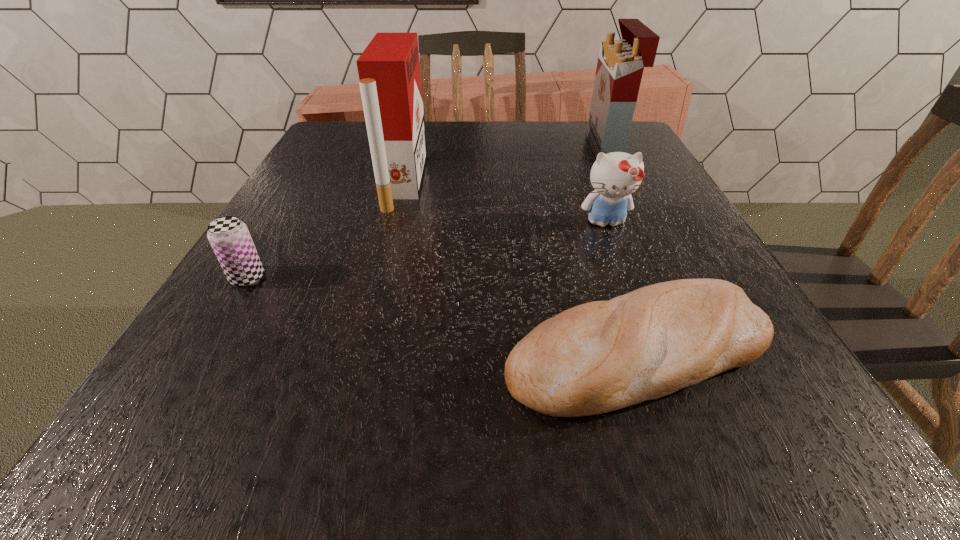
The height and width of the screenshot is (540, 960). I want to click on free spot that satisfies the following two spatial constraints: 1. on the front-facing side of the fourth object from right to left; 2. on the front side of the fourth tallest object, so click(378, 278).

You are a GUI agent. You are given a task and a screenshot of the screen. Output one action in this format:
    pyautogui.click(x=<x>, y=<y>)
    Task: Click on the vacant space that satisfies the following two spatial constraints: 1. with the lid open on the right cigarette case; 2. on the front side of the second nearest object
    The height and width of the screenshot is (540, 960).
    Given the screenshot: What is the action you would take?
    pyautogui.click(x=672, y=278)